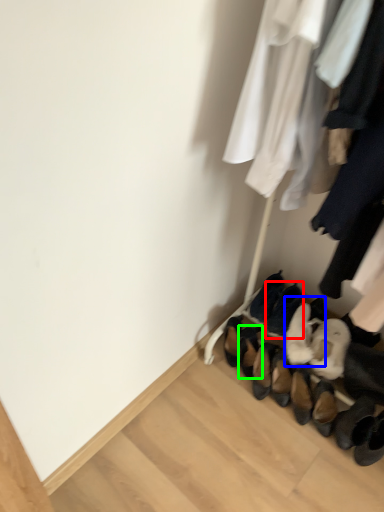
Question: Which object is positioned farthest from footwear (highlighted by a red box)? Select from footwear (highlighted by a blue box) and footwear (highlighted by a green box).

Choices:
 (A) footwear
 (B) footwear

Answer: (B)